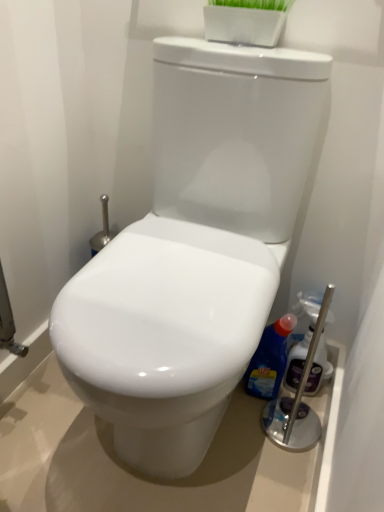
Question: Should I look upward or downward to see blue glossy bottle at right, positioned as the first cleaning product in left-to-right order?

Choices:
 (A) down
 (B) up

Answer: (A)

Question: Is blue glossy bottle at right, placed as the 2th cleaning product when sorted from right to left, smaller than white glossy toilet at center?

Choices:
 (A) yes
 (B) no

Answer: (A)

Question: Is blue glossy bottle at right, positioned as the first cleaning product in left-to-right order, taller than white glossy toilet at center?

Choices:
 (A) no
 (B) yes

Answer: (A)

Question: From the image's perspective, is blue glossy bottle at right, positioned as the first cleaning product in left-to-right order, beneath white glossy toilet at center?

Choices:
 (A) no
 (B) yes

Answer: (B)

Question: Is blue glossy bottle at right, placed as the 2th cleaning product when sorted from right to left, outside of white glossy toilet at center?

Choices:
 (A) no
 (B) yes

Answer: (A)

Question: Can you confirm if blue glossy bottle at right, positioned as the first cleaning product in left-to-right order, is positioned to the left of white glossy toilet at center?

Choices:
 (A) no
 (B) yes

Answer: (A)

Question: Can you confirm if blue glossy bottle at right, placed as the 2th cleaning product when sorted from right to left, is thinner than white glossy toilet at center?

Choices:
 (A) yes
 (B) no

Answer: (A)

Question: From the image's perspective, is blue glossy bottle at right, positioned as the first cleaning product in left-to-right order, under translucent plastic spray bottle at right, which is counted as the first cleaning product, starting from the right?

Choices:
 (A) no
 (B) yes

Answer: (B)

Question: Can you confirm if blue glossy bottle at right, placed as the 2th cleaning product when sorted from right to left, is positioned to the left of translucent plastic spray bottle at right, which is counted as the first cleaning product, starting from the right?

Choices:
 (A) yes
 (B) no

Answer: (A)

Question: Does blue glossy bottle at right, positioned as the first cleaning product in left-to-right order, appear on the right side of translucent plastic spray bottle at right, the second cleaning product in the left-to-right sequence?

Choices:
 (A) no
 (B) yes

Answer: (A)

Question: Is translucent plastic spray bottle at right, which is counted as the first cleaning product, starting from the right, at the back of blue glossy bottle at right, placed as the 2th cleaning product when sorted from right to left?

Choices:
 (A) yes
 (B) no

Answer: (B)

Question: Is blue glossy bottle at right, positioned as the first cleaning product in left-to-right order, thinner than translucent plastic spray bottle at right, the second cleaning product in the left-to-right sequence?

Choices:
 (A) yes
 (B) no

Answer: (B)

Question: Is translucent plastic spray bottle at right, the second cleaning product in the left-to-right sequence, located within blue glossy bottle at right, placed as the 2th cleaning product when sorted from right to left?

Choices:
 (A) no
 (B) yes

Answer: (A)

Question: Considering the relative sizes of white glossy toilet at center and translucent plastic spray bottle at right, which is counted as the first cleaning product, starting from the right, in the image provided, is white glossy toilet at center bigger than translucent plastic spray bottle at right, which is counted as the first cleaning product, starting from the right,?

Choices:
 (A) no
 (B) yes

Answer: (B)